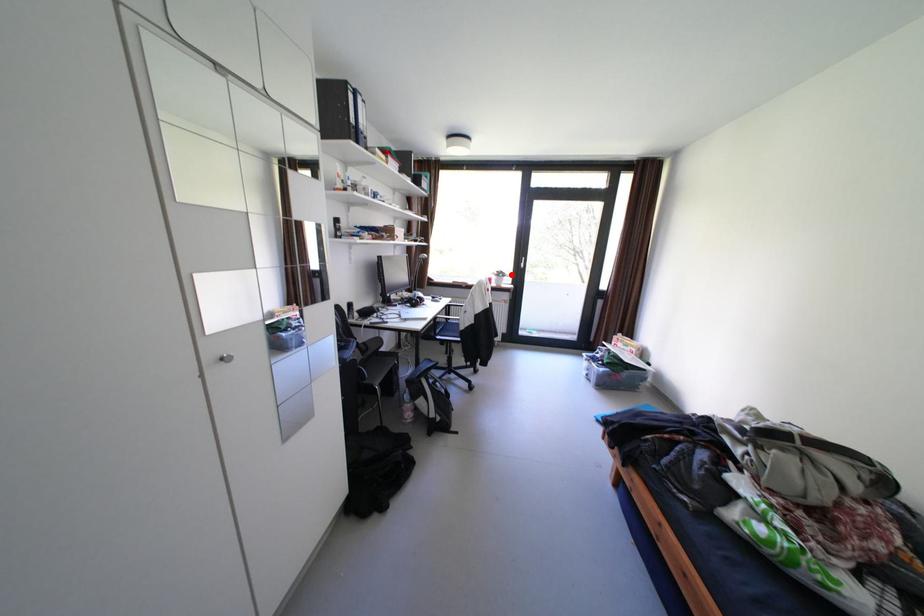
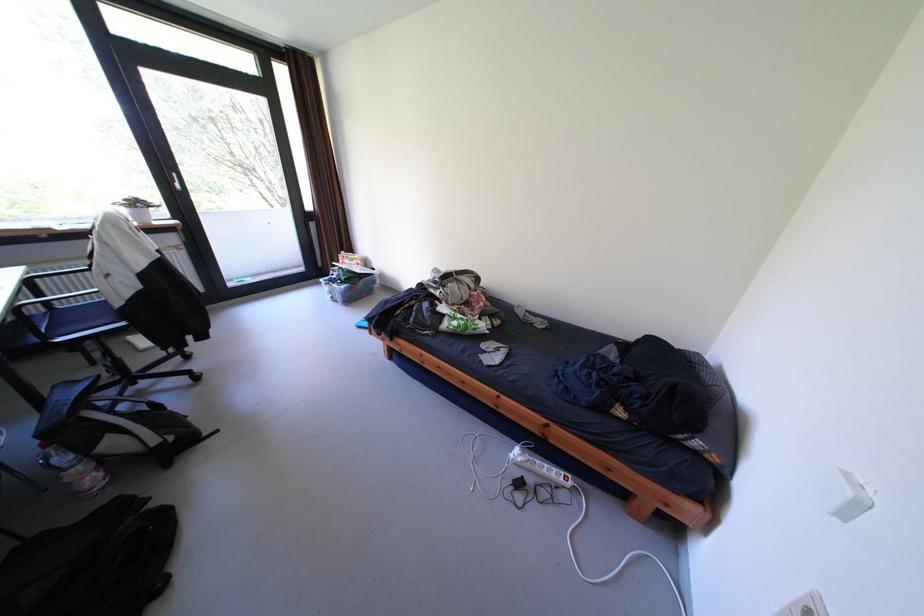
The point at the highlighted location is marked in the first image. Where is the corresponding point in the second image?

(149, 205)